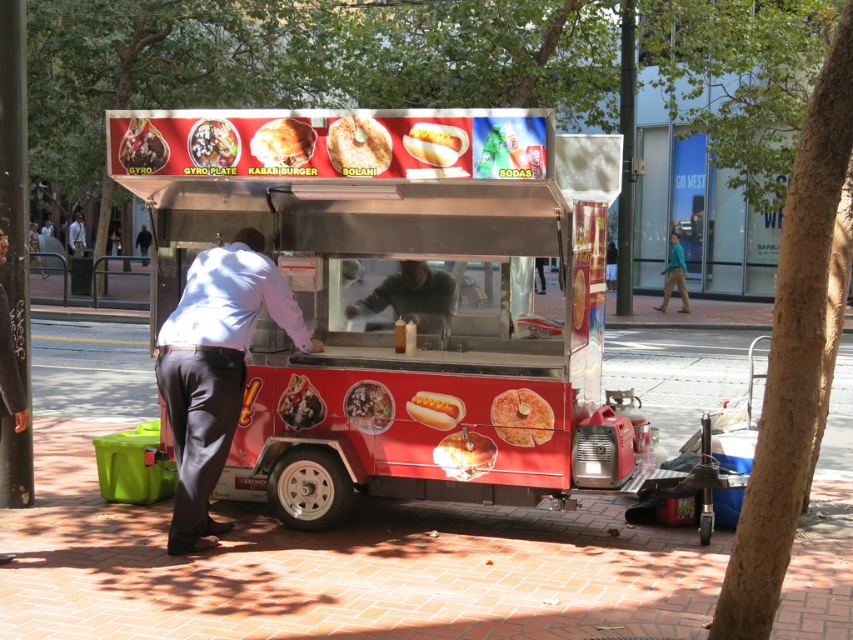
You are a customer waiting in line at the shiny red food truck at center and notice a person wearing a white shirt at center. Which object is positioned to the right of the other?

The shiny red food truck at center is to the right of the white shirt at center.

Consider the image. You are a food delivery person who needs to pick up an order containing both the golden crispy kabab burger at center and the shiny plastic hot dog at center. If you can only carry one item at a time, which item should you pick up first to minimize the distance walked?

The golden crispy kabab burger at center is 1.36 meters away from the shiny plastic hot dog at center, so you should pick up the golden crispy kabab burger at center first and then the shiny plastic hot dog at center to minimize the distance walked.